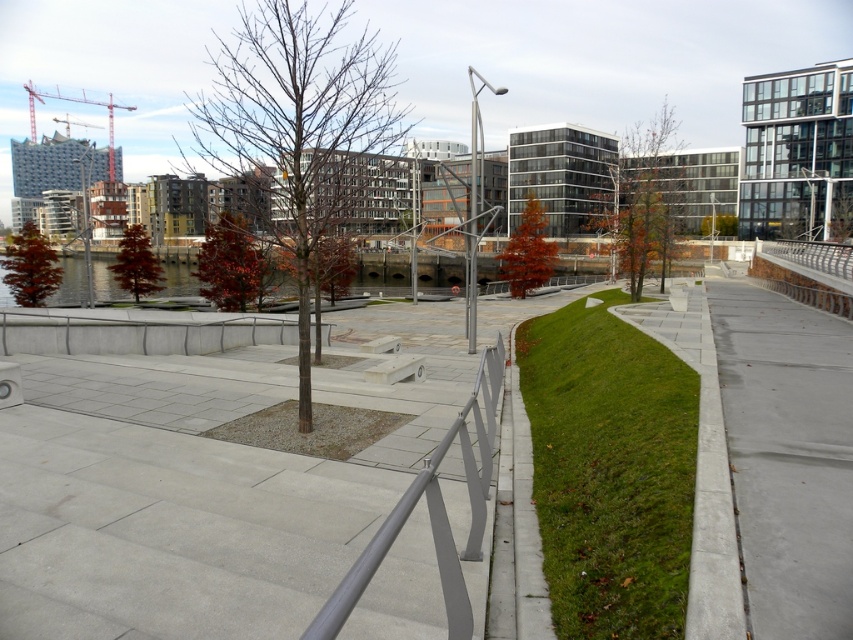
Question: Which point is farther to the camera?

Choices:
 (A) bare wood tree at center
 (B) gray concrete pavement at center
 (C) red glossy tree at center
 (D) gray concrete pavement at right

Answer: (C)

Question: Observing the image, what is the correct spatial positioning of bare wood tree at center in reference to red matte tree at left?

Choices:
 (A) right
 (B) left

Answer: (A)

Question: Can you confirm if silver metallic rail at center is positioned above orange matte tree at center?

Choices:
 (A) no
 (B) yes

Answer: (A)

Question: Which object is farther from the camera taking this photo?

Choices:
 (A) orange matte tree at center
 (B) red matte tree at center

Answer: (A)

Question: Does green grass at center appear on the left side of orange matte tree at center?

Choices:
 (A) no
 (B) yes

Answer: (B)

Question: Which object is the closest to the gray concrete pavement at right?

Choices:
 (A) red glossy tree at center
 (B) orange matte tree at center
 (C) green grass at center

Answer: (C)